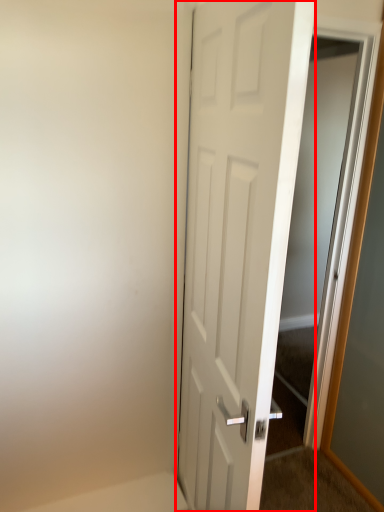
Question: Considering the relative positions of door (annotated by the red box) and elevator in the image provided, where is door (annotated by the red box) located with respect to the staircase?

Choices:
 (A) left
 (B) right

Answer: (A)